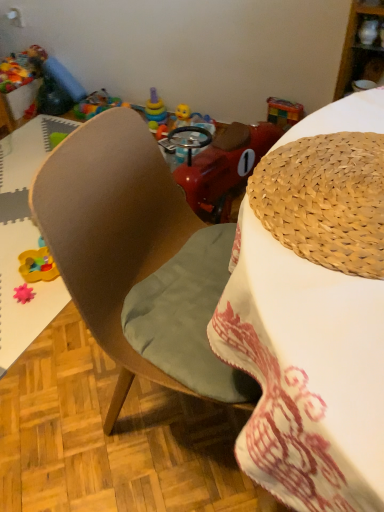
Question: From a real-world perspective, relative to pink rubber star at lower left, which is the 3th toy in right-to-left order, is translucent plastic sippy cup at center, the 3th toy in the left-to-right sequence, vertically above or below?

Choices:
 (A) above
 (B) below

Answer: (A)

Question: Is translucent plastic sippy cup at center, acting as the 1th toy starting from the right, taller or shorter than pink rubber star at lower left, which is the 3th toy in right-to-left order?

Choices:
 (A) short
 (B) tall

Answer: (B)

Question: Which object is positioned closest to the wooden cabinet at upper right?

Choices:
 (A) woven straw hat at upper right
 (B) rubberized plastic toy at upper left, which ranks as the second toy in left-to-right order
 (C) translucent plastic sippy cup at center, acting as the 2th toy starting from the back
 (D) pink rubber star at lower left, which ranks as the 1th toy in front-to-back order
 (E) brown wooden chair at center

Answer: (C)

Question: Estimate the real-world distances between objects in this image. Which object is closer to the rubberized plastic toy at upper left, placed as the third toy when sorted from front to back?

Choices:
 (A) translucent plastic sippy cup at center, acting as the 1th toy starting from the right
 (B) pink rubber star at lower left, which ranks as the 1th toy in front-to-back order
 (C) brown wooden chair at center
 (D) woven straw hat at upper right
 (E) wooden cabinet at upper right

Answer: (A)